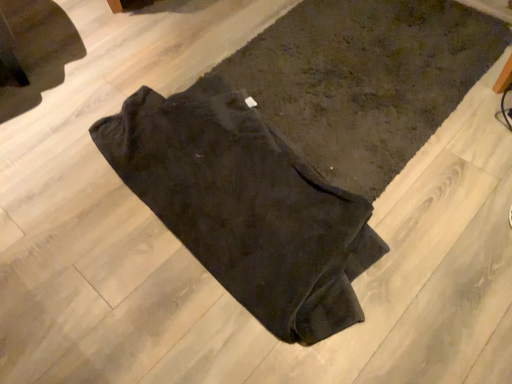
In order to face dark gray cotton trousers at center, should I rotate leftwards or rightwards?

It's best to rotate left around 3.379 degrees.

Locate an element on the screen. dark gray cotton trousers at center is located at coordinates (245, 206).

The image size is (512, 384). Describe the element at coordinates (245, 206) in the screenshot. I see `dark gray cotton trousers at center` at that location.

Locate an element on the screen. dark gray cotton trousers at center is located at coordinates (245, 206).